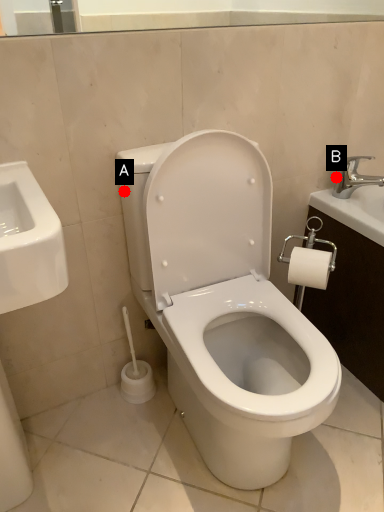
Question: Two points are circled on the image, labeled by A and B beside each circle. Which point appears farthest from the camera in this image?

Choices:
 (A) A is further
 (B) B is further

Answer: (B)